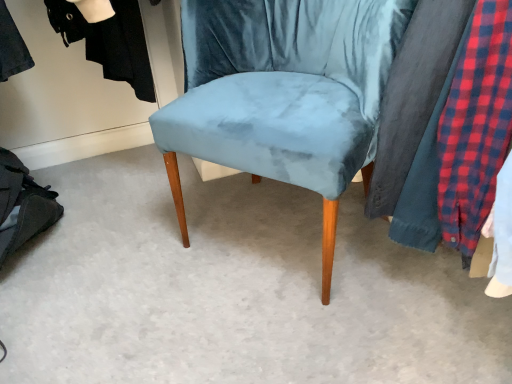
What is the approximate width of velvet blue chair at center?

20.73 inches.

What do you see at coordinates (283, 94) in the screenshot?
I see `velvet blue chair at center` at bounding box center [283, 94].

What are the coordinates of `velvet blue chair at center` in the screenshot? It's located at (x=283, y=94).

In order to click on velvet blue chair at center in this screenshot , I will do `click(283, 94)`.